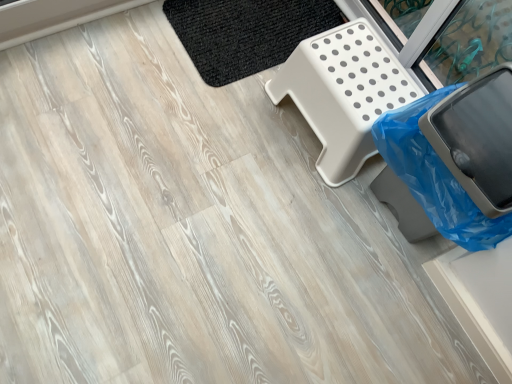
The width and height of the screenshot is (512, 384). What are the coordinates of `free space in front of blue plastic trash can at lower right` in the screenshot? It's located at (367, 288).